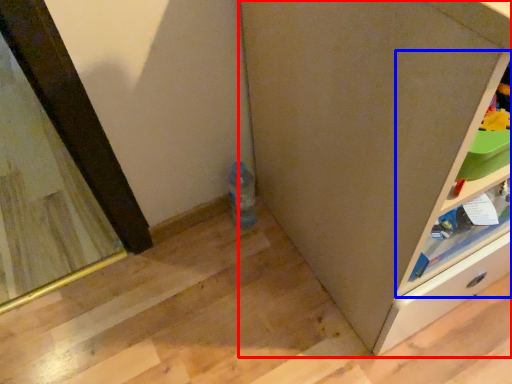
Question: Which object is further to the camera taking this photo, cabinetry (highlighted by a red box) or shelf (highlighted by a blue box)?

Choices:
 (A) cabinetry
 (B) shelf

Answer: (B)